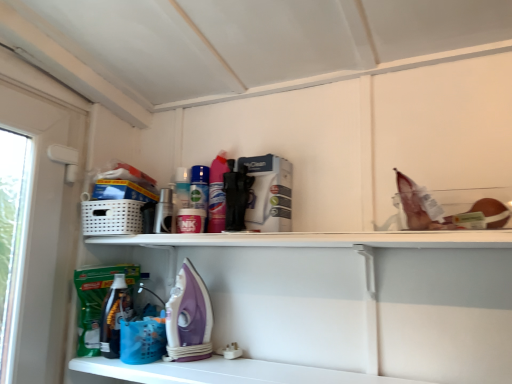
Question: Is white glossy shelf at lower center far from purple plastic iron at lower center?

Choices:
 (A) no
 (B) yes

Answer: (A)

Question: From a real-world perspective, is white glossy shelf at lower center beneath purple plastic iron at lower center?

Choices:
 (A) yes
 (B) no

Answer: (A)

Question: From the image's perspective, is white glossy shelf at lower center located above purple plastic iron at lower center?

Choices:
 (A) no
 (B) yes

Answer: (A)

Question: Can purple plastic iron at lower center be found inside white glossy shelf at lower center?

Choices:
 (A) yes
 (B) no

Answer: (B)

Question: From the image's perspective, is white glossy shelf at lower center located beneath purple plastic iron at lower center?

Choices:
 (A) no
 (B) yes

Answer: (B)

Question: Considering their positions, is blue plastic basket at lower center located in front of or behind purple plastic iron at lower center?

Choices:
 (A) front
 (B) behind

Answer: (B)

Question: Considering the positions of point (137, 322) and point (193, 332), is point (137, 322) closer or farther from the camera than point (193, 332)?

Choices:
 (A) farther
 (B) closer

Answer: (B)

Question: In terms of width, does blue plastic basket at lower center look wider or thinner when compared to purple plastic iron at lower center?

Choices:
 (A) thin
 (B) wide

Answer: (B)

Question: From the image's perspective, relative to purple plastic iron at lower center, is blue plastic basket at lower center above or below?

Choices:
 (A) above
 (B) below

Answer: (B)

Question: In the image, is white glossy shelf at lower center positioned in front of or behind purple plastic iron at lower center?

Choices:
 (A) front
 (B) behind

Answer: (A)

Question: From a real-world perspective, is white glossy shelf at lower center above or below purple plastic iron at lower center?

Choices:
 (A) above
 (B) below

Answer: (B)

Question: From the image's perspective, is white glossy shelf at lower center located above or below purple plastic iron at lower center?

Choices:
 (A) above
 (B) below

Answer: (B)

Question: Is point (204, 362) closer or farther from the camera than point (198, 326)?

Choices:
 (A) closer
 (B) farther

Answer: (A)

Question: From the image's perspective, is purple plastic iron at lower center located above or below blue plastic basket at lower center?

Choices:
 (A) below
 (B) above

Answer: (B)

Question: From their relative heights in the image, would you say purple plastic iron at lower center is taller or shorter than blue plastic basket at lower center?

Choices:
 (A) short
 (B) tall

Answer: (B)